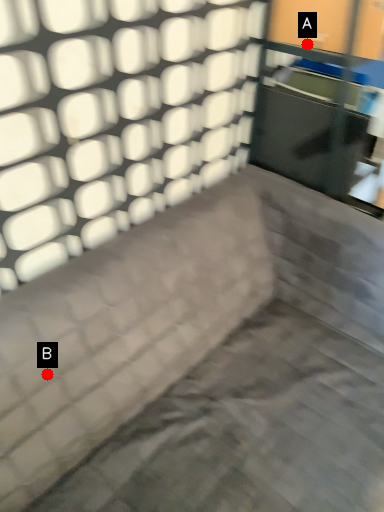
Question: Two points are circled on the image, labeled by A and B beside each circle. Which point is farther to the camera?

Choices:
 (A) A is further
 (B) B is further

Answer: (A)